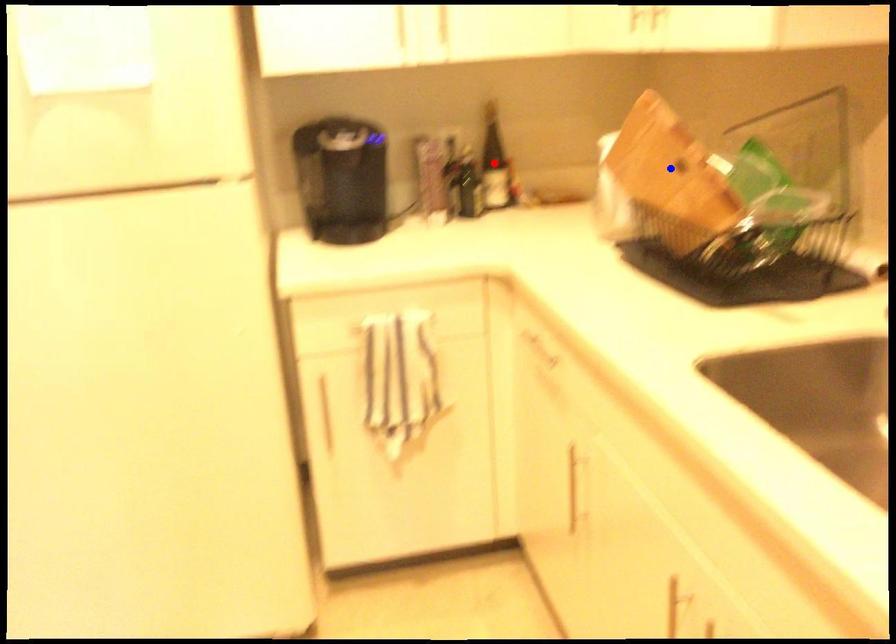
Question: Two points are marked on the image. Which point is closer to the camera?

Choices:
 (A) Blue point is closer.
 (B) Red point is closer.

Answer: (A)